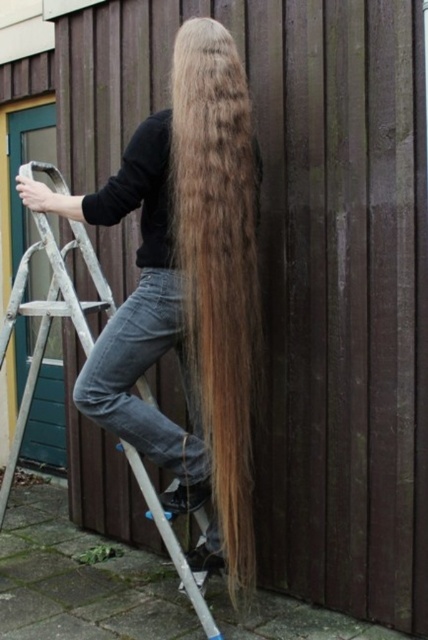
You are an architect designing a new building and want to ensure safety for workers. Based on the image, what is the exact 2D coordinate of the golden brown silky hair at center?

The exact 2D coordinate of the golden brown silky hair at center is at point (x=217, y=273).

You are an interior designer assessing the space in the image. The golden brown silky hair at center and the metallic silver ladder at center are both present. Which object occupies a smaller area in the image?

The golden brown silky hair at center has a smaller size compared to the metallic silver ladder at center, so it occupies a smaller area in the image.

From the picture: You are a photographer setting up for a portrait. The subject is standing on a ladder against a wooden wall. You notice a specific point in the image at coordinates point (217, 273). What object does this point correspond to?

The point (217, 273) corresponds to the golden brown silky hair at center.